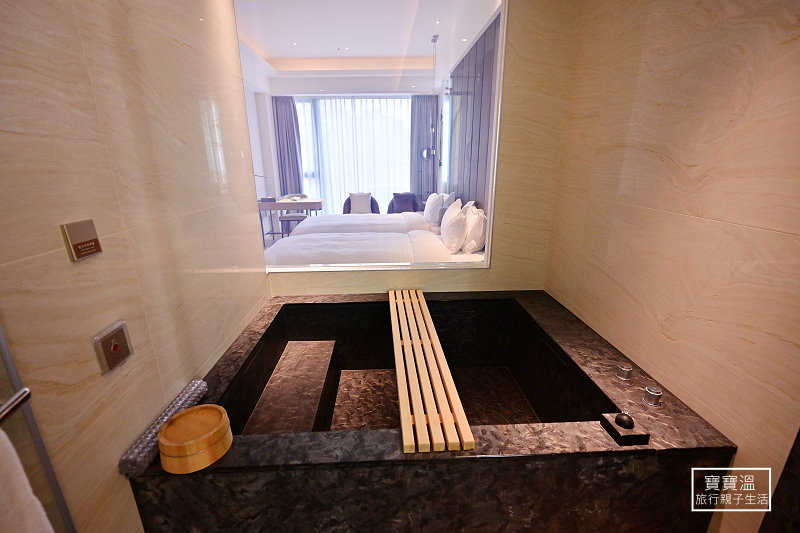
Where is `dark marble bathtub's steps`? This screenshot has width=800, height=533. dark marble bathtub's steps is located at coordinates (294, 414), (350, 411), (497, 415).